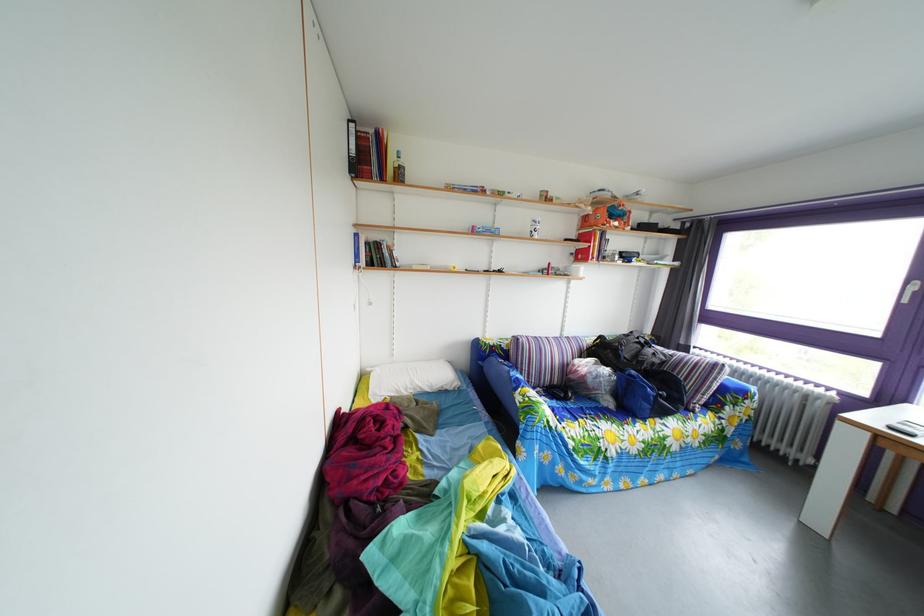
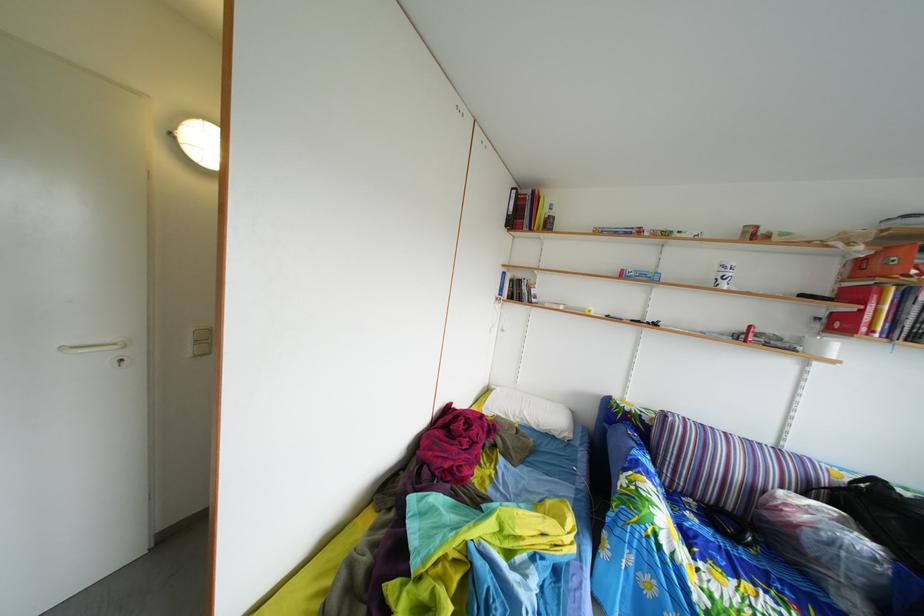
In the second image, find the point that corresponds to point 541,232 in the first image.

(727, 276)